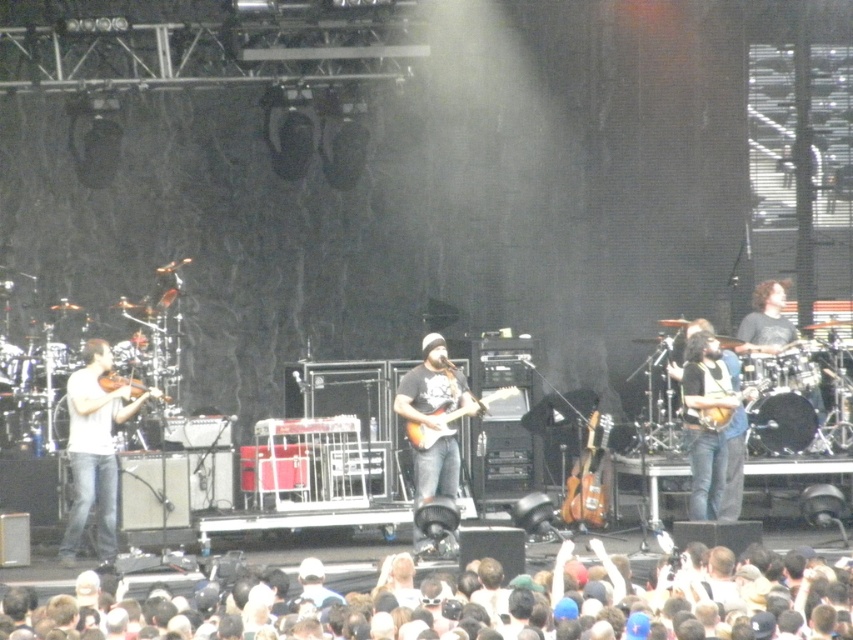
Looking at this image, is white cotton crowd at lower center to the right of matte brown violin at left from the viewer's perspective?

Indeed, white cotton crowd at lower center is positioned on the right side of matte brown violin at left.

Can you confirm if white cotton crowd at lower center is positioned to the left of matte brown violin at left?

No, white cotton crowd at lower center is not to the left of matte brown violin at left.

Is point (76, 625) positioned before point (140, 388)?

That is True.

This screenshot has width=853, height=640. In order to click on white cotton crowd at lower center in this screenshot , I will do `click(477, 602)`.

Find the location of `wooden electric guitar at center`. wooden electric guitar at center is located at coordinates (451, 419).

Can you confirm if wooden electric guitar at center is taller than wooden acoustic guitar at right?

Yes.

Is point (514, 385) closer to viewer compared to point (747, 388)?

No, (514, 385) is further to viewer.

At what (x,y) coordinates should I click in order to perform the action: click on wooden electric guitar at center. Please return your answer as a coordinate pair (x, y). This screenshot has height=640, width=853. Looking at the image, I should click on (451, 419).

Between brown wood guitar at center and wooden electric guitar at center, which one has less height?

wooden electric guitar at center

Which is in front, point (595, 456) or point (485, 397)?

Point (595, 456) is more forward.

Is point (587, 493) positioned in front of point (413, 426)?

No, it is behind (413, 426).

The height and width of the screenshot is (640, 853). I want to click on brown wood guitar at center, so click(589, 477).